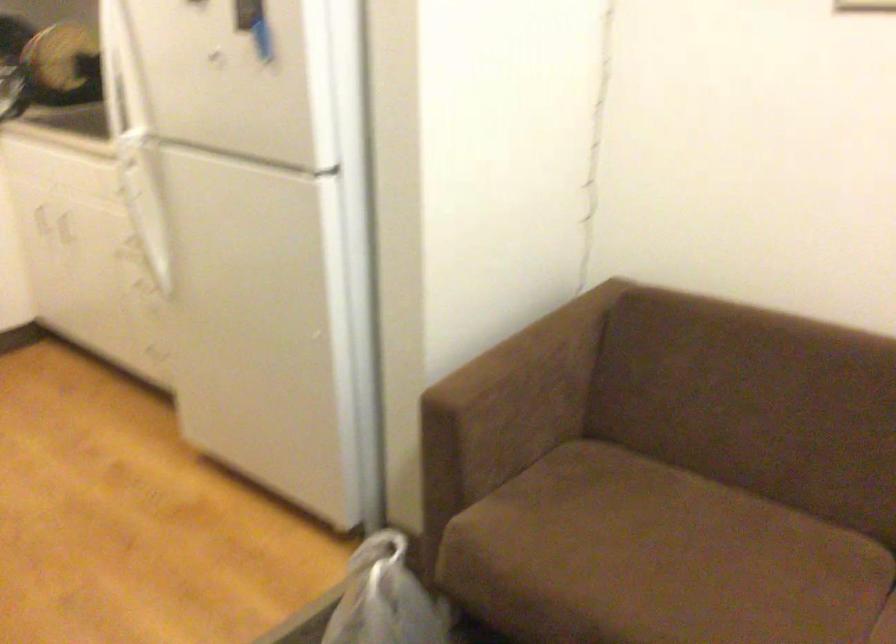
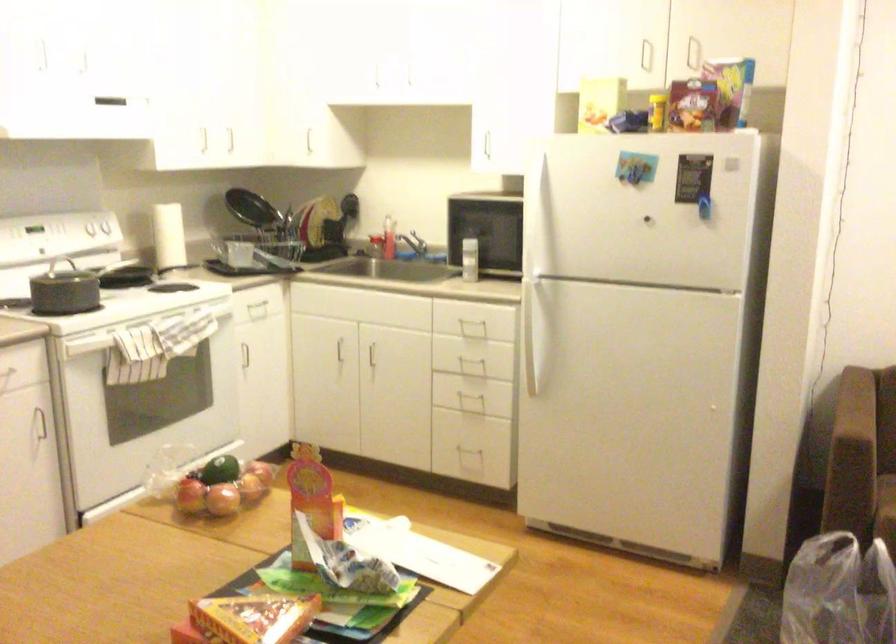
In the second image, find the point that corresponds to the point at 436,504 in the first image.

(863, 513)